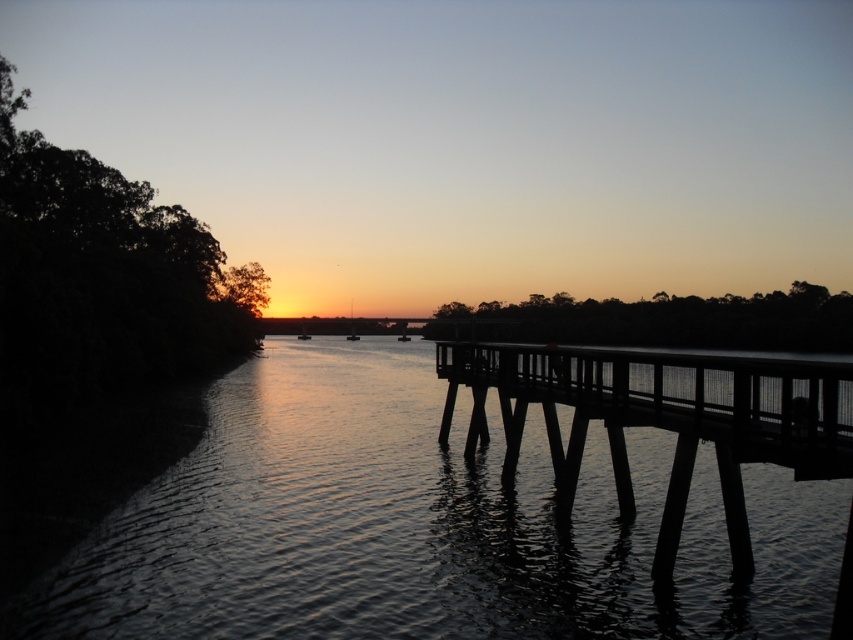
Does dark water at center have a larger size compared to black wood dock at right?

No, dark water at center is not bigger than black wood dock at right.

Between dark water at center and black wood dock at right, which one is positioned lower?

Positioned lower is black wood dock at right.

The width and height of the screenshot is (853, 640). Describe the element at coordinates (422, 525) in the screenshot. I see `dark water at center` at that location.

Find the location of a particular element. The width and height of the screenshot is (853, 640). dark water at center is located at coordinates (422, 525).